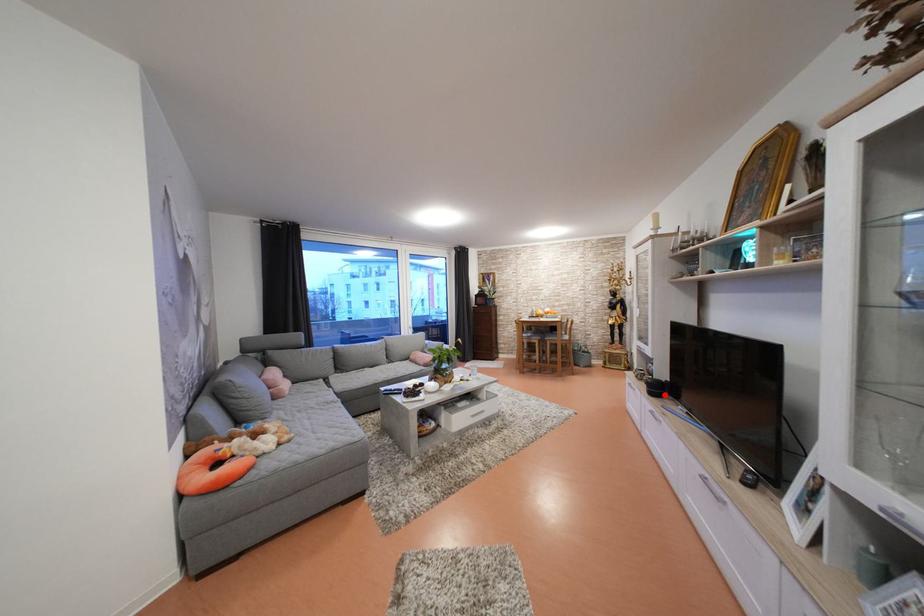
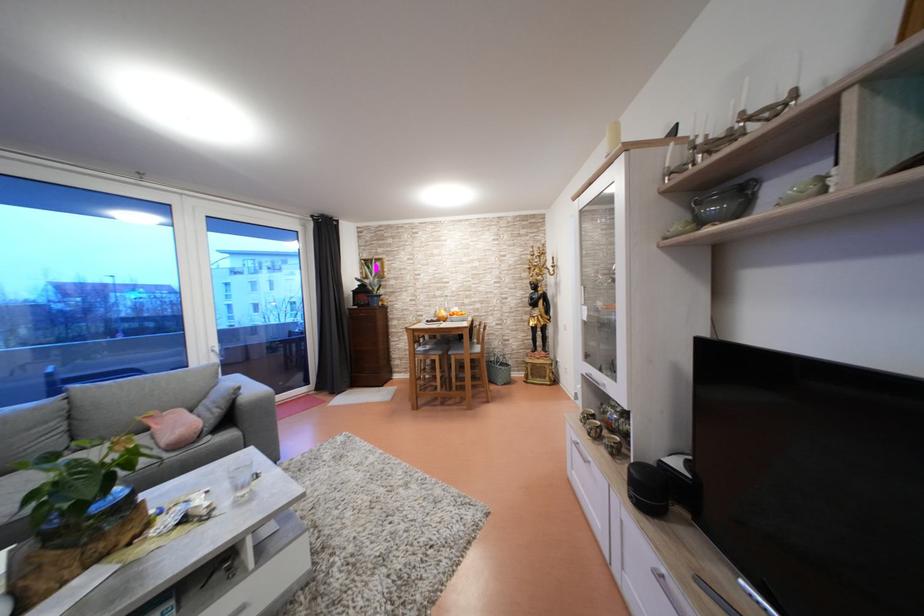
Find the pixel in the second image that matches the highlighted location in the first image.

(662, 500)